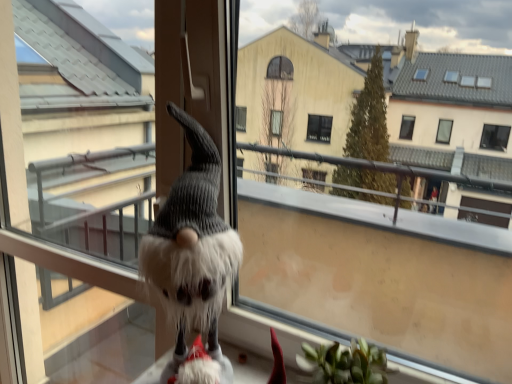
Question: Is fuzzy gray screen door at center surrounding fluffy white gnome at center?

Choices:
 (A) no
 (B) yes

Answer: (A)

Question: From the image's perspective, is fuzzy gray screen door at center located above fluffy white gnome at center?

Choices:
 (A) no
 (B) yes

Answer: (A)

Question: Can you confirm if fuzzy gray screen door at center is thinner than fluffy white gnome at center?

Choices:
 (A) yes
 (B) no

Answer: (A)

Question: Does fuzzy gray screen door at center have a greater width compared to fluffy white gnome at center?

Choices:
 (A) no
 (B) yes

Answer: (A)

Question: From the image's perspective, does fuzzy gray screen door at center appear lower than fluffy white gnome at center?

Choices:
 (A) yes
 (B) no

Answer: (A)

Question: Is fuzzy gray screen door at center to the left of fluffy white gnome at center from the viewer's perspective?

Choices:
 (A) yes
 (B) no

Answer: (A)

Question: Is fuzzy gray screen door at center bigger than fuzzy fabric gnome at lower left?

Choices:
 (A) no
 (B) yes

Answer: (B)

Question: Is fuzzy gray screen door at center further to the viewer compared to fuzzy fabric gnome at lower left?

Choices:
 (A) no
 (B) yes

Answer: (B)

Question: Does fuzzy gray screen door at center have a lesser height compared to fuzzy fabric gnome at lower left?

Choices:
 (A) no
 (B) yes

Answer: (A)

Question: From the image's perspective, would you say fuzzy gray screen door at center is positioned over fuzzy fabric gnome at lower left?

Choices:
 (A) no
 (B) yes

Answer: (A)

Question: Considering the relative sizes of fuzzy gray screen door at center and fuzzy fabric gnome at lower left in the image provided, is fuzzy gray screen door at center thinner than fuzzy fabric gnome at lower left?

Choices:
 (A) yes
 (B) no

Answer: (A)

Question: Does fuzzy gray screen door at center have a greater height compared to fuzzy fabric gnome at lower left?

Choices:
 (A) yes
 (B) no

Answer: (A)

Question: Is the surface of fuzzy fabric gnome at lower left in direct contact with fluffy white gnome at center?

Choices:
 (A) yes
 (B) no

Answer: (B)